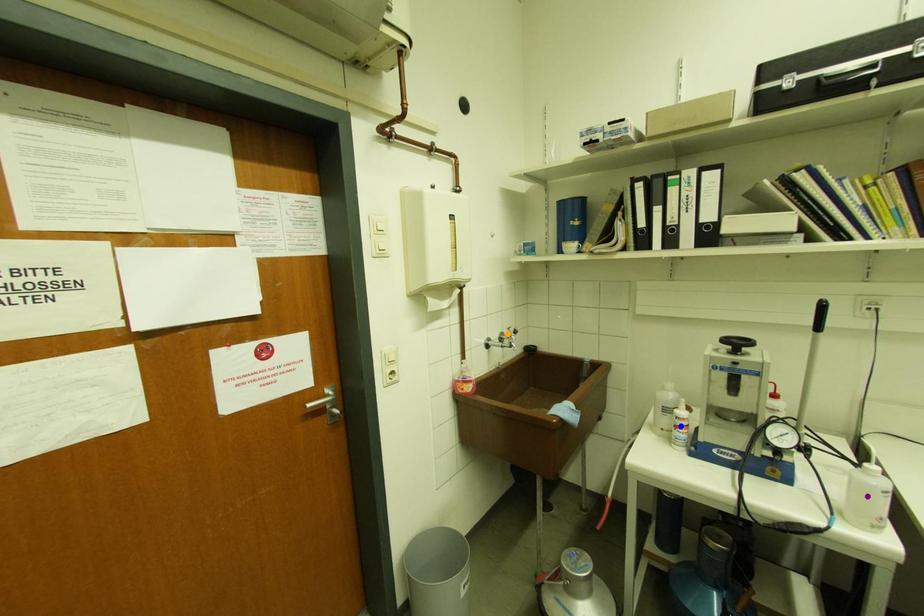
Based on the photo, order these from nearest to farthest:
blue point | purple point | orange point

orange point → blue point → purple point